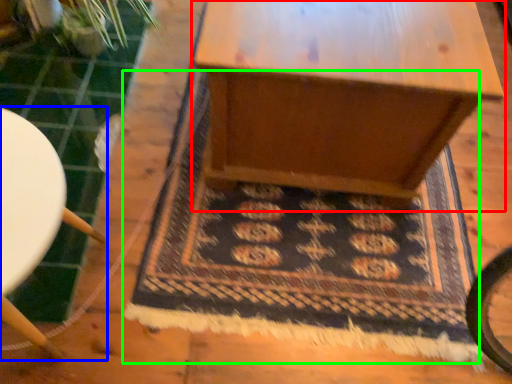
Question: Which object is the closest to the table (highlighted by a red box)? Choose among these: furniture (highlighted by a blue box) or mat (highlighted by a green box).

Choices:
 (A) furniture
 (B) mat

Answer: (B)